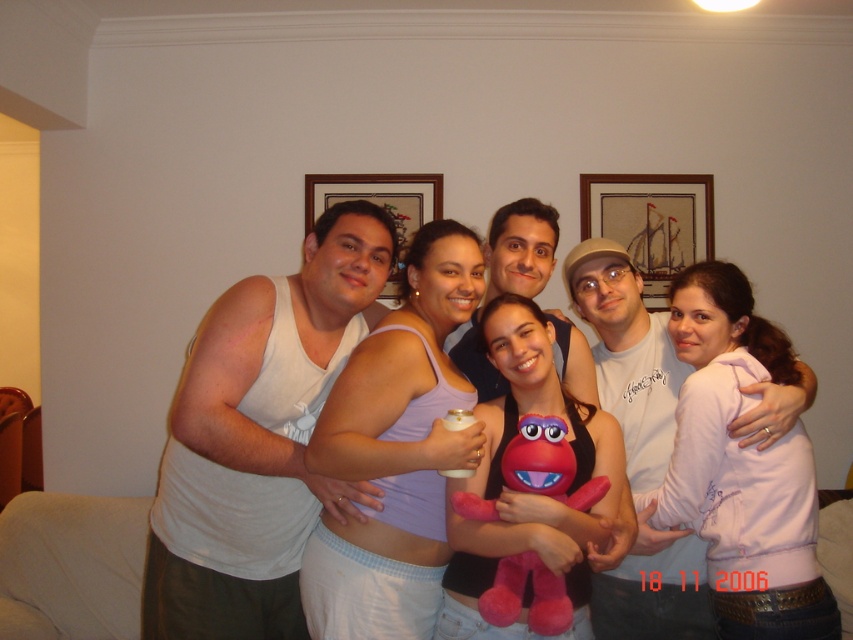
Question: Is light purple fabric tank top at center behind matte pink plush at center?

Choices:
 (A) yes
 (B) no

Answer: (A)

Question: Which of the following is the closest to the observer?

Choices:
 (A) (496, 513)
 (B) (332, 481)
 (C) (590, 600)
 (D) (509, 236)

Answer: (A)

Question: Where is white matte tank top at center located in relation to wooden framed picture at upper center in the image?

Choices:
 (A) above
 (B) below

Answer: (B)

Question: Considering the real-world distances, which object is closest to the matte pink plush at center?

Choices:
 (A) white matte tank top at center
 (B) brushed metal picture frame at upper center
 (C) wooden framed picture at upper center
 (D) matte white tank top at center

Answer: (D)

Question: Based on their relative distances, which object is nearer to the light purple fabric tank top at center?

Choices:
 (A) white matte tank top at center
 (B) brushed metal picture frame at upper center
 (C) white t-shirt at center
 (D) matte white tank top at center

Answer: (A)

Question: Does white t-shirt at center have a smaller size compared to wooden framed picture at upper center?

Choices:
 (A) yes
 (B) no

Answer: (B)